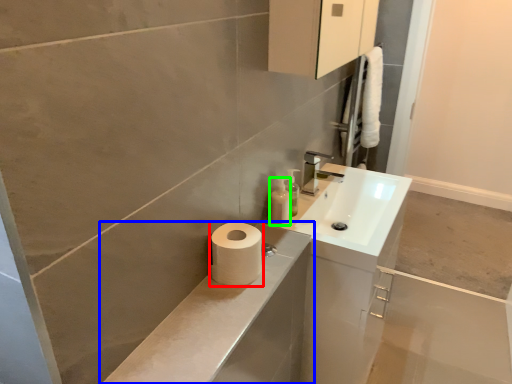
Question: Which object is the closest to the toilet paper (highlighted by a red box)? Choose among these: bathroom cabinet (highlighted by a blue box) or toiletry (highlighted by a green box).

Choices:
 (A) bathroom cabinet
 (B) toiletry

Answer: (A)